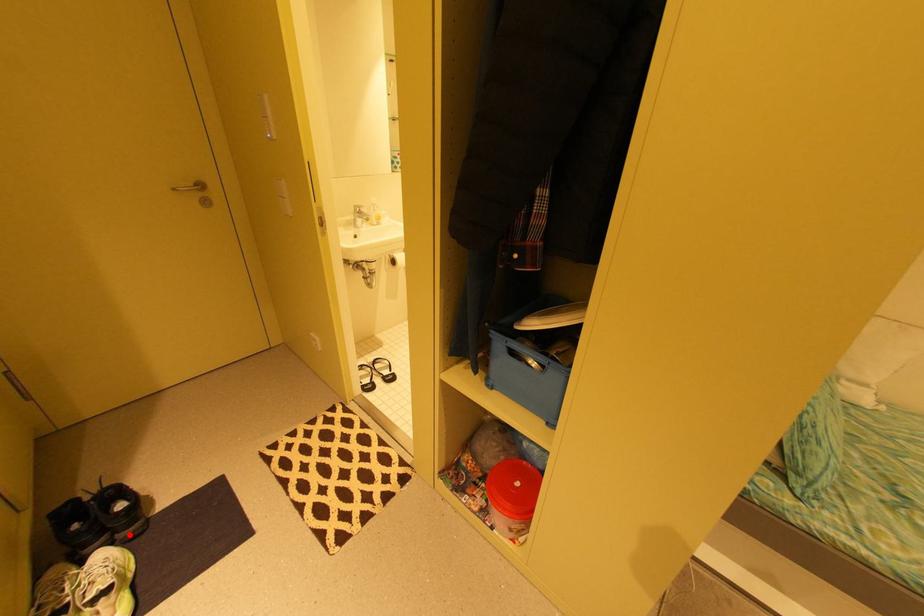
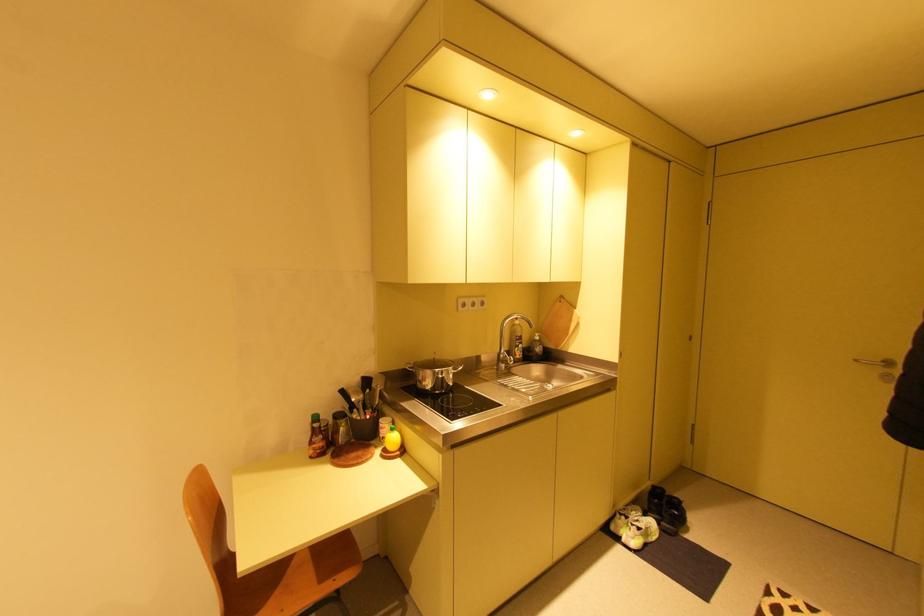
Find the pixel in the second image that matches the highlighted location in the first image.

(670, 524)